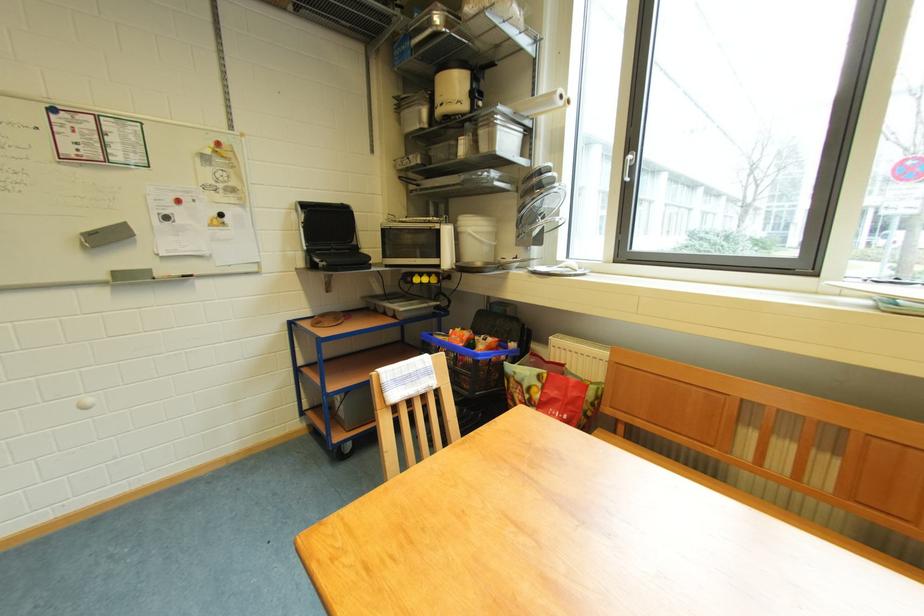
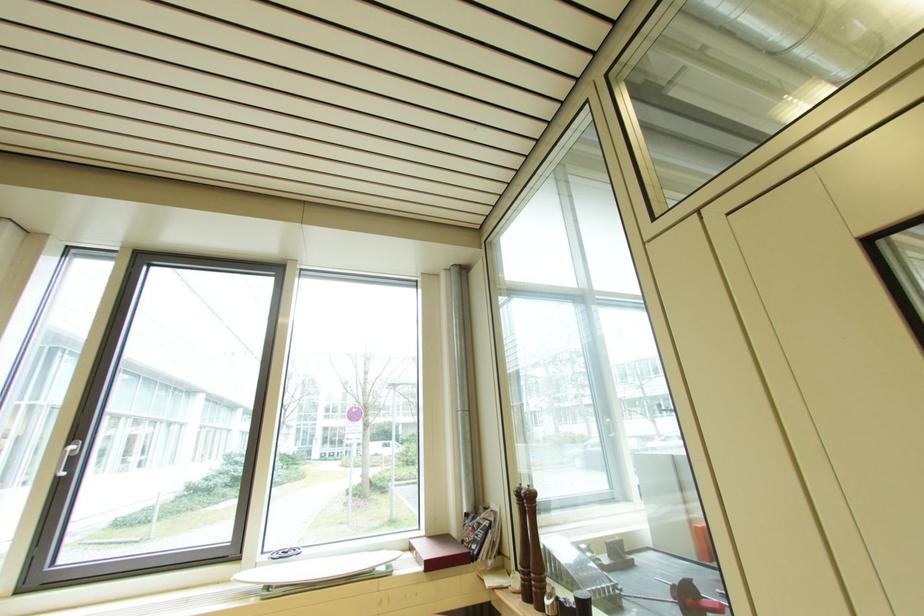
The point at (634,161) is marked in the first image. Where is the corresponding point in the second image?

(73, 455)